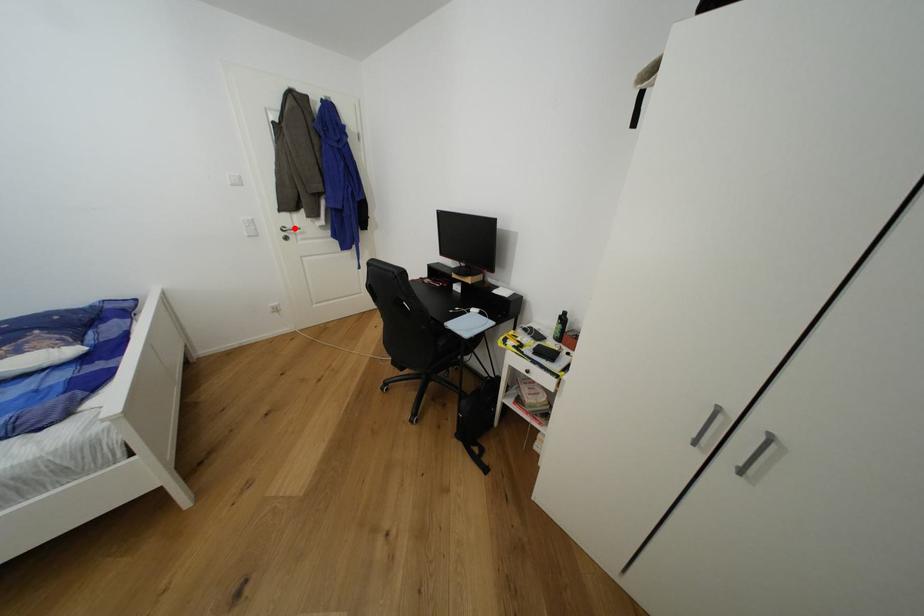
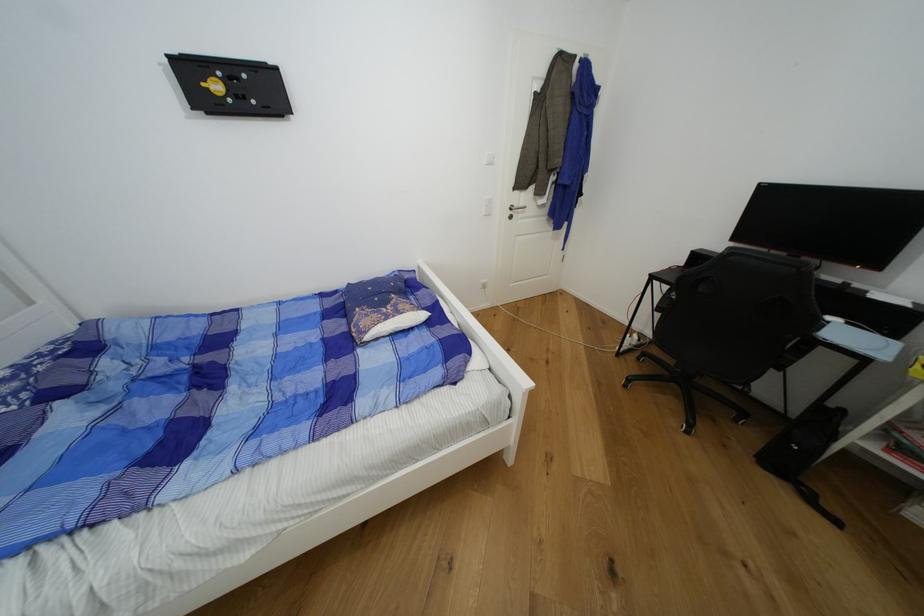
Locate, in the second image, the point that corresponds to the highlighted location in the first image.

(521, 207)